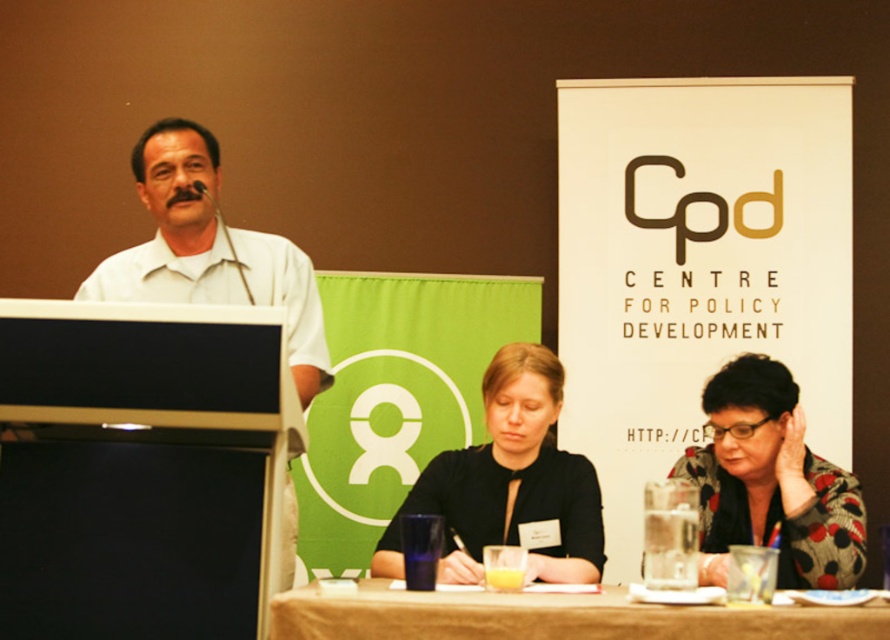
You are a photographer setting up for a group photo. You need to position a small tripod between the polka dot fabric jacket at lower right and the brown wooden table at lower center. The tripod requires 18 inches of space. Can you fit it between them?

The polka dot fabric jacket at lower right and brown wooden table at lower center are 25.41 inches apart from each other. Since the tripod requires 18 inches of space, there is enough room to place it between them.

You are sitting at the back of the room and want to ask a question to the speaker. Which person should you direct your question to, the matte black shirt at center or the white matte shirt at left?

You should direct your question to the matte black shirt at center because they are in front of the white matte shirt at left, making them the speaker closest to you.